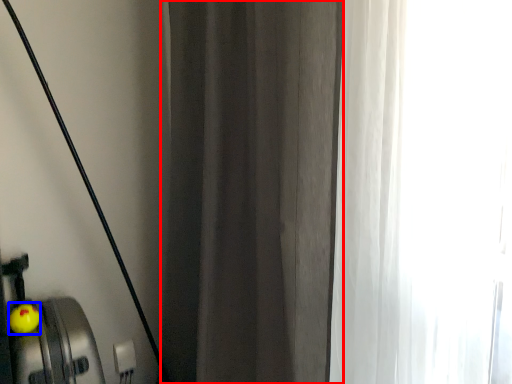
Question: Which object appears farthest to the camera in this image, curtain (highlighted by a red box) or apple (highlighted by a blue box)?

Choices:
 (A) curtain
 (B) apple

Answer: (B)